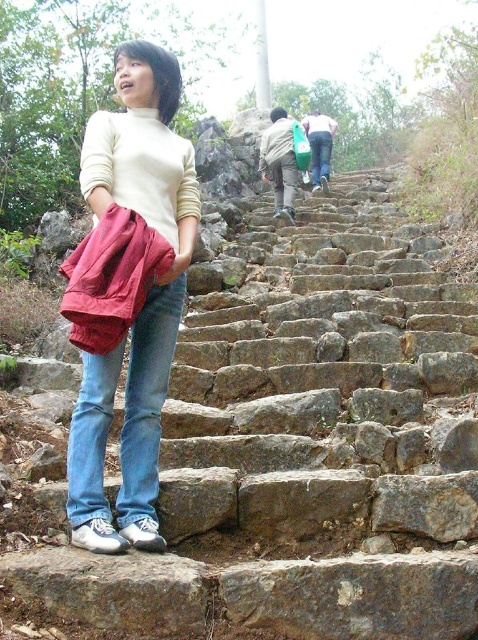
Question: Which object is the farthest from the matte white sweater at center?

Choices:
 (A) blue denim jeans at lower left
 (B) blue denim jeans at upper center

Answer: (B)

Question: Can you confirm if rustic stone stairs at center is wider than blue denim jeans at upper center?

Choices:
 (A) no
 (B) yes

Answer: (B)

Question: Which point is closer to the camera taking this photo?

Choices:
 (A) (274, 129)
 (B) (99, 410)
 (C) (456, 566)

Answer: (C)

Question: Does matte white sweater at center appear on the left side of green fabric bag at upper center?

Choices:
 (A) yes
 (B) no

Answer: (A)

Question: Which object appears farthest from the camera in this image?

Choices:
 (A) blue denim jeans at lower left
 (B) rustic stone stairs at center
 (C) blue denim jeans at upper center

Answer: (C)

Question: Does matte white sweater at center come in front of blue denim jeans at lower left?

Choices:
 (A) yes
 (B) no

Answer: (A)